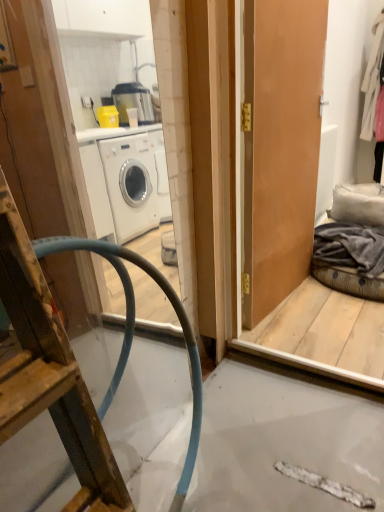
Where is `vacant space to the right of matte brown door at center`? vacant space to the right of matte brown door at center is located at coordinates (329, 301).